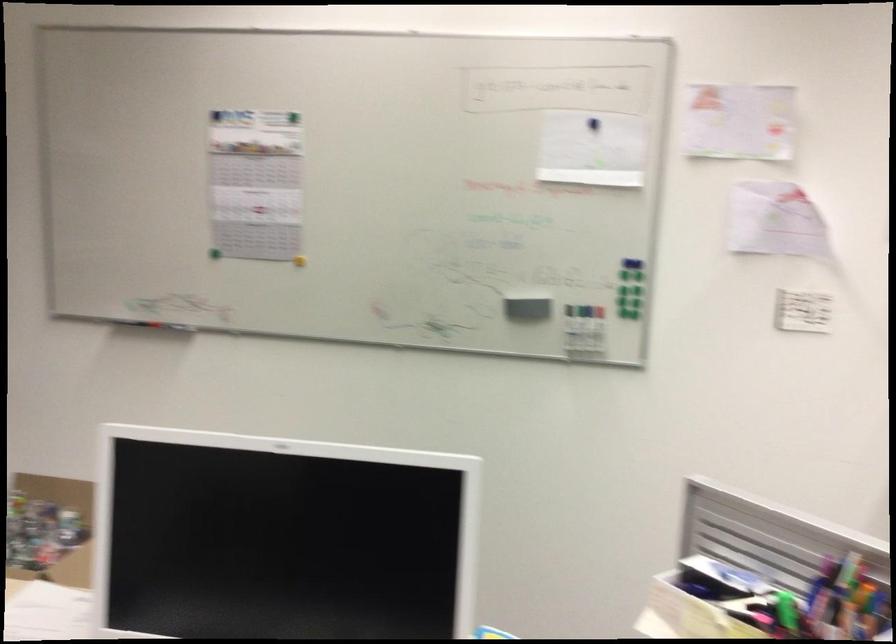
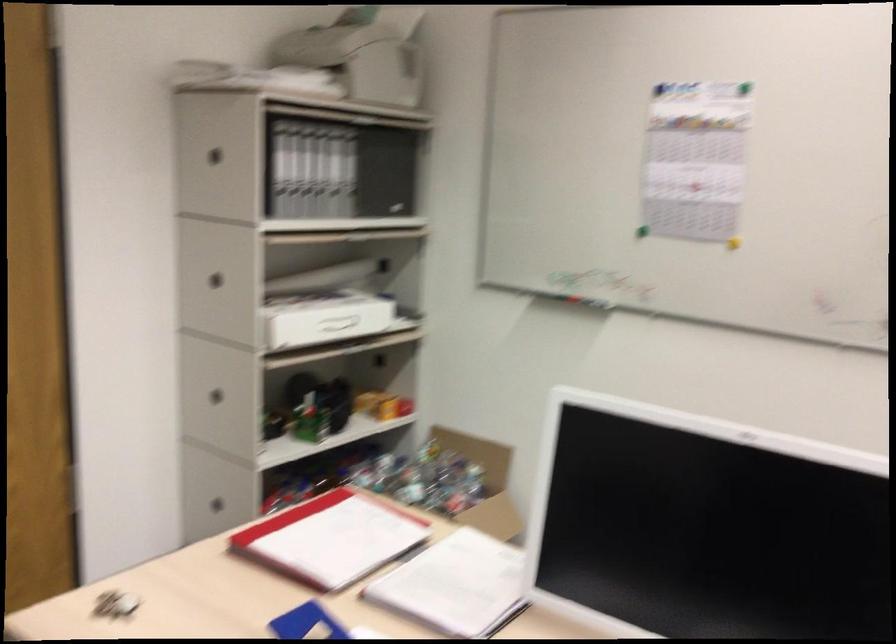
The images are taken continuously from a first-person perspective. In which direction are you moving?

The movement direction of the cameraman is left, forward.